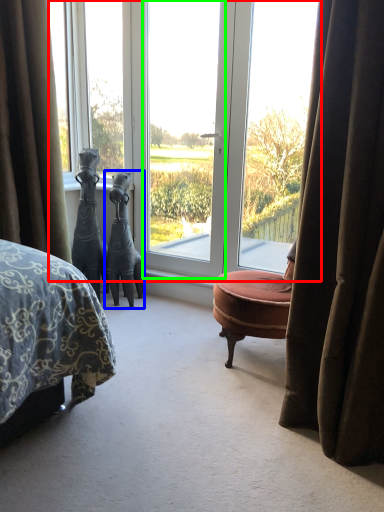
Question: Which object is the farthest from window (highlighted by a red box)? Choose among these: sculpture (highlighted by a blue box) or screen door (highlighted by a green box).

Choices:
 (A) sculpture
 (B) screen door

Answer: (A)